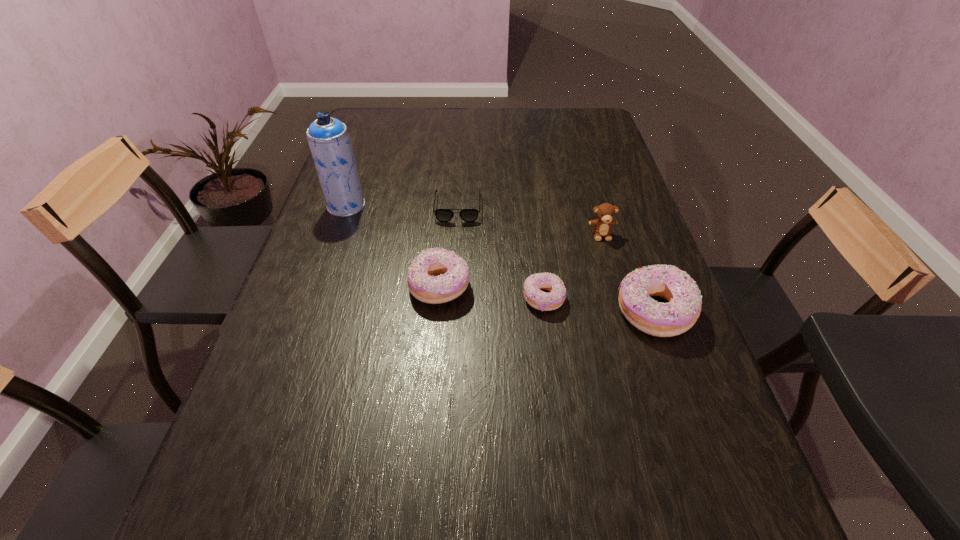
Where is `empty location between the rightmost doughnut and the aerosol can`? empty location between the rightmost doughnut and the aerosol can is located at coordinates (500, 259).

Where is `vacant space that is in between the spectacles and the fourth nearest object`? vacant space that is in between the spectacles and the fourth nearest object is located at coordinates (529, 221).

Identify the location of object that ranks as the fourth closest to the rightmost doughnut. The image size is (960, 540). (443, 215).

Locate an element on the screen. The image size is (960, 540). object that is the second closest to the spectacles is located at coordinates (328, 138).

Find the location of a particular element. This screenshot has width=960, height=540. the third closest doughnut to the spectacles is located at coordinates (670, 319).

Choose which doughnut is the second nearest neighbor to the spectacles. Please provide its 2D coordinates. Your answer should be formatted as a tuple, i.e. [(x, y)], where the tuple contains the x and y coordinates of a point satisfying the conditions above.

[(540, 300)]

At what (x,y) coordinates should I click in order to perform the action: click on vacant space that satisfies the following two spatial constraints: 1. on the front-facing side of the spectacles; 2. on the left side of the rightmost doughnut. Please return your answer as a coordinate pair (x, y). The image size is (960, 540). Looking at the image, I should click on (452, 312).

Find the location of a particular element. This screenshot has height=540, width=960. vacant space that satisfies the following two spatial constraints: 1. on the front-facing side of the third object from right to left; 2. on the right side of the spectacles is located at coordinates (452, 299).

Find the location of a particular element. vacant area in the image that satisfies the following two spatial constraints: 1. on the front-facing side of the second doughnut from right to left; 2. on the left side of the spectacles is located at coordinates (452, 299).

Image resolution: width=960 pixels, height=540 pixels. I want to click on vacant space that satisfies the following two spatial constraints: 1. on the front side of the fourth tallest object; 2. on the right side of the rightmost doughnut, so click(x=438, y=312).